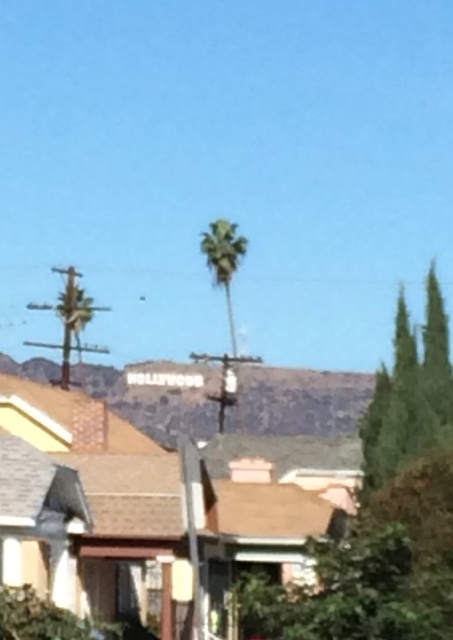
Question: Does green leafy tree at right have a greater width compared to green leafy palm at center?

Choices:
 (A) no
 (B) yes

Answer: (A)

Question: Which point is farther to the camera?

Choices:
 (A) green leafy tree at right
 (B) green leafy palm at center

Answer: (B)

Question: Where is green leafy tree at right located in relation to green leafy palm at center in the image?

Choices:
 (A) below
 (B) above

Answer: (A)

Question: Does green leafy tree at right appear on the right side of green leafy palm at center?

Choices:
 (A) yes
 (B) no

Answer: (A)

Question: Which point is farther from the camera taking this photo?

Choices:
 (A) (222, 230)
 (B) (424, 424)

Answer: (A)